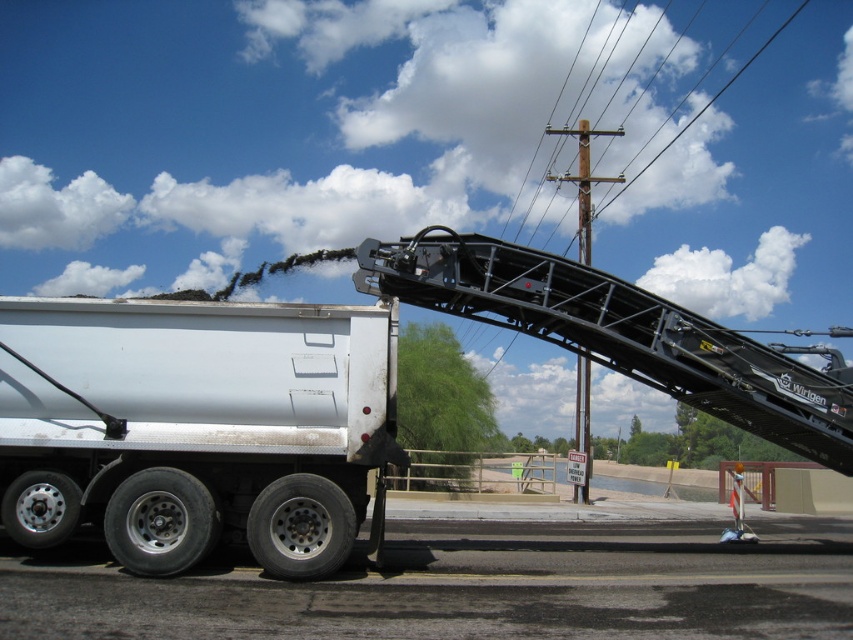
Between white matte truck at lower left and black metal power line at upper center, which one has less height?

white matte truck at lower left

Which is above, white matte truck at lower left or black metal power line at upper center?

black metal power line at upper center

Which is in front, point (265, 330) or point (581, 200)?

Point (265, 330) is in front.

The width and height of the screenshot is (853, 640). In order to click on white matte truck at lower left in this screenshot , I will do `click(194, 426)`.

Is brown wooden telegraph pole at upper center shorter than black metal power line at upper center?

Indeed, brown wooden telegraph pole at upper center has a lesser height compared to black metal power line at upper center.

Who is lower down, brown wooden telegraph pole at upper center or black metal power line at upper center?

brown wooden telegraph pole at upper center is lower down.

Between point (583, 384) and point (721, 88), which one is positioned in front?

Point (583, 384) is more forward.

I want to click on brown wooden telegraph pole at upper center, so click(x=583, y=180).

Which is above, white matte truck at lower left or brown wooden telegraph pole at upper center?

Positioned higher is white matte truck at lower left.

Between point (302, 560) and point (589, 394), which one is positioned behind?

Positioned behind is point (589, 394).

What do you see at coordinates (194, 426) in the screenshot?
I see `white matte truck at lower left` at bounding box center [194, 426].

Find the location of a particular element. The height and width of the screenshot is (640, 853). white matte truck at lower left is located at coordinates (194, 426).